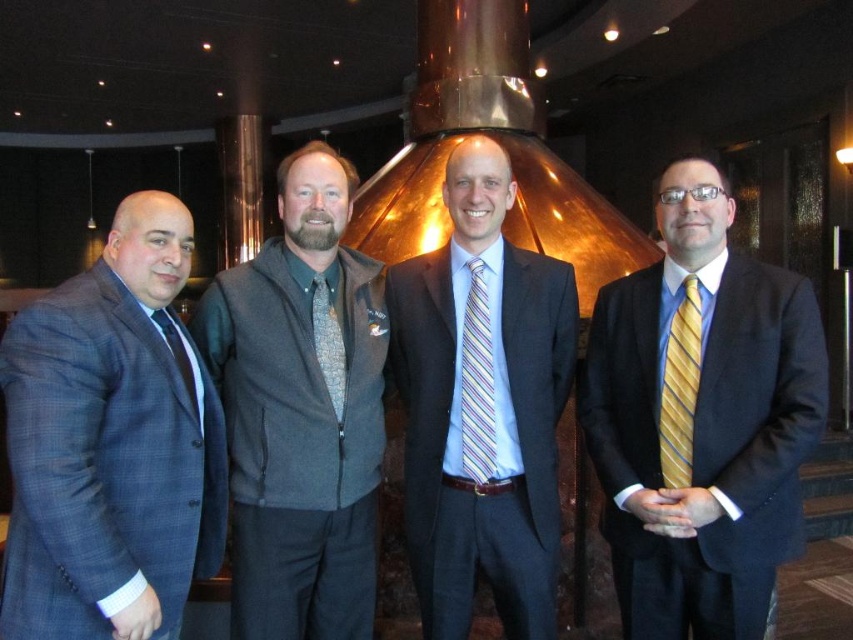
Is point (323, 360) positioned before point (177, 339)?

No.

Does patterned fabric tie at center appear under matte black tie at left?

Actually, patterned fabric tie at center is above matte black tie at left.

Is point (321, 282) positioned after point (193, 374)?

Yes.

I want to click on patterned fabric tie at center, so point(328,342).

Does plaid wool suit at left have a lesser width compared to striped silk tie at center?

No.

Is plaid wool suit at left positioned in front of striped silk tie at center?

That is True.

Is point (79, 630) positioned after point (477, 337)?

That is False.

This screenshot has width=853, height=640. I want to click on plaid wool suit at left, so click(x=111, y=444).

Is point (248, 340) less distant than point (196, 403)?

No, (248, 340) is further to viewer.

Can you confirm if gray fleece vest at center is smaller than matte black tie at left?

No.

Which is in front, point (322, 534) or point (178, 342)?

Point (178, 342) is in front.

Locate an element on the screen. This screenshot has height=640, width=853. gray fleece vest at center is located at coordinates (300, 412).